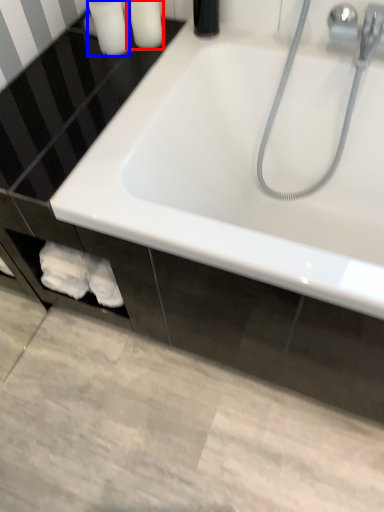
Question: Which of the following is the closest to the observer, toiletry (highlighted by a red box) or toiletry (highlighted by a blue box)?

Choices:
 (A) toiletry
 (B) toiletry

Answer: (B)